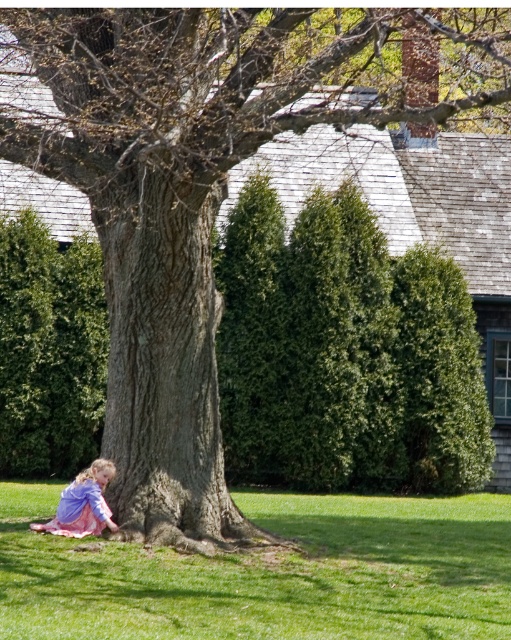
Question: Can you confirm if green grass at lower left is positioned below pink satin dress at lower left?

Choices:
 (A) yes
 (B) no

Answer: (A)

Question: Can you confirm if green grass at lower left is thinner than pink satin dress at lower left?

Choices:
 (A) no
 (B) yes

Answer: (A)

Question: Is green grass at lower left smaller than pink satin dress at lower left?

Choices:
 (A) yes
 (B) no

Answer: (B)

Question: Which point appears farthest from the camera in this image?

Choices:
 (A) [247, 588]
 (B) [73, 483]

Answer: (B)

Question: Among these objects, which one is farthest from the camera?

Choices:
 (A) green grass at lower left
 (B) pink satin dress at lower left

Answer: (B)